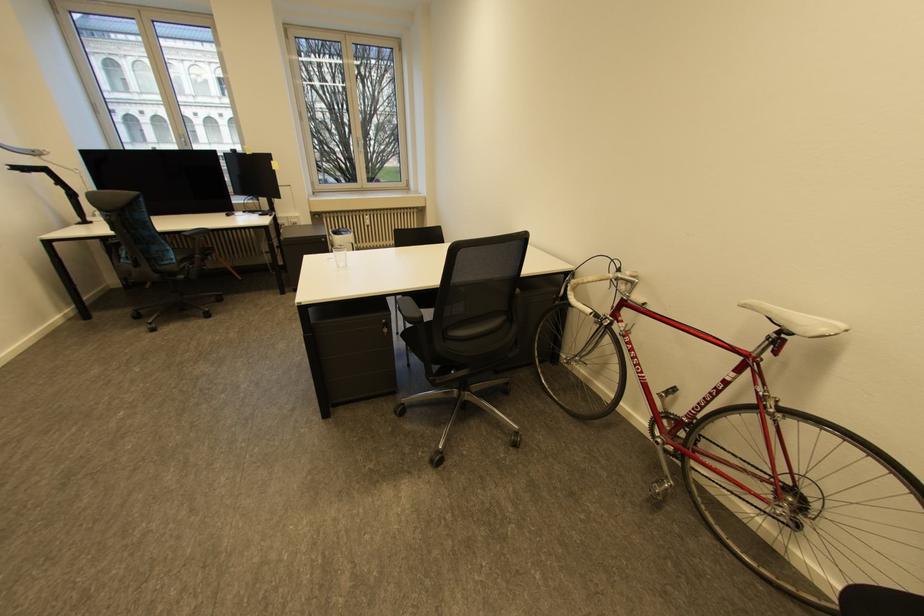
Describe the element at coordinates (371, 224) in the screenshot. I see `a white radiator valve` at that location.